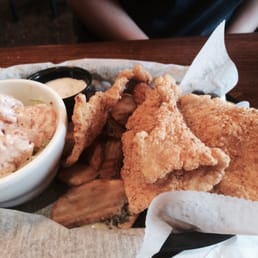
Find the location of a particular element. This screenshot has width=258, height=258. black ceramic sauce cup is located at coordinates (70, 72).